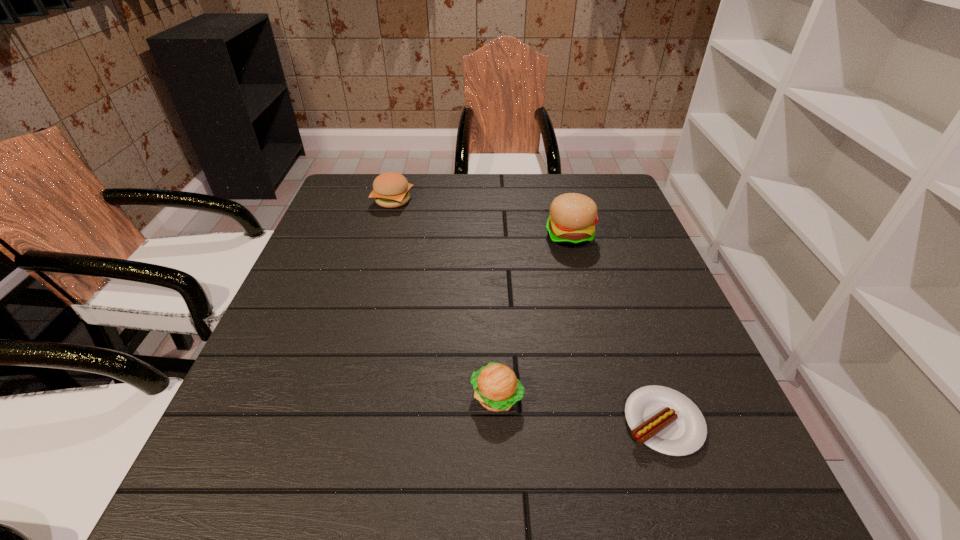
Where is `the third nearest object`? The height and width of the screenshot is (540, 960). the third nearest object is located at coordinates (573, 216).

Where is `the second nearest hamburger`? The height and width of the screenshot is (540, 960). the second nearest hamburger is located at coordinates (573, 216).

Where is `the third shortest object`? The height and width of the screenshot is (540, 960). the third shortest object is located at coordinates (391, 190).

The height and width of the screenshot is (540, 960). Find the location of `the farthest hamburger`. the farthest hamburger is located at coordinates (391, 190).

The height and width of the screenshot is (540, 960). I want to click on the second shortest object, so click(x=496, y=387).

Where is `the shortest hamburger`? the shortest hamburger is located at coordinates (496, 387).

Where is `the shortest object`? This screenshot has width=960, height=540. the shortest object is located at coordinates (665, 420).

Find the location of a particular element. The width and height of the screenshot is (960, 540). vacant region located on the front of the second farthest object is located at coordinates (582, 284).

Identify the location of vacant space located 0.220m on the front of the leftmost object. (375, 262).

Find the location of a particular element. This screenshot has height=540, width=960. free space located on the front of the second shortest object is located at coordinates (499, 483).